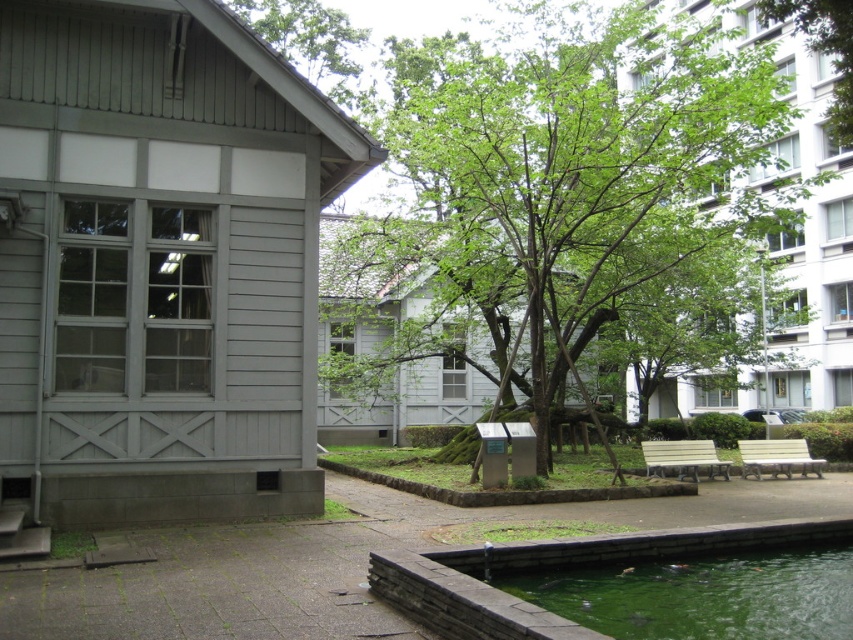
Question: Is green concrete pool at lower center bigger than light brown wooden bench at lower right?

Choices:
 (A) no
 (B) yes

Answer: (B)

Question: Which of the following is the farthest from the observer?

Choices:
 (A) (419, 241)
 (B) (766, 468)
 (C) (593, 554)
 (D) (706, 445)

Answer: (A)

Question: Observing the image, what is the correct spatial positioning of green leafy tree at center in reference to light brown wooden bench at lower right?

Choices:
 (A) above
 (B) below

Answer: (A)

Question: Which of the following is the closest to the observer?

Choices:
 (A) green leafy tree at center
 (B) green concrete pool at lower center
 (C) light beige wooden bench at lower right

Answer: (B)

Question: Does green leafy tree at center have a smaller size compared to green concrete pool at lower center?

Choices:
 (A) yes
 (B) no

Answer: (B)

Question: Among these objects, which one is farthest from the camera?

Choices:
 (A) green concrete pool at lower center
 (B) light brown wooden bench at lower right
 (C) light beige wooden bench at lower right
 (D) green leafy tree at center

Answer: (C)